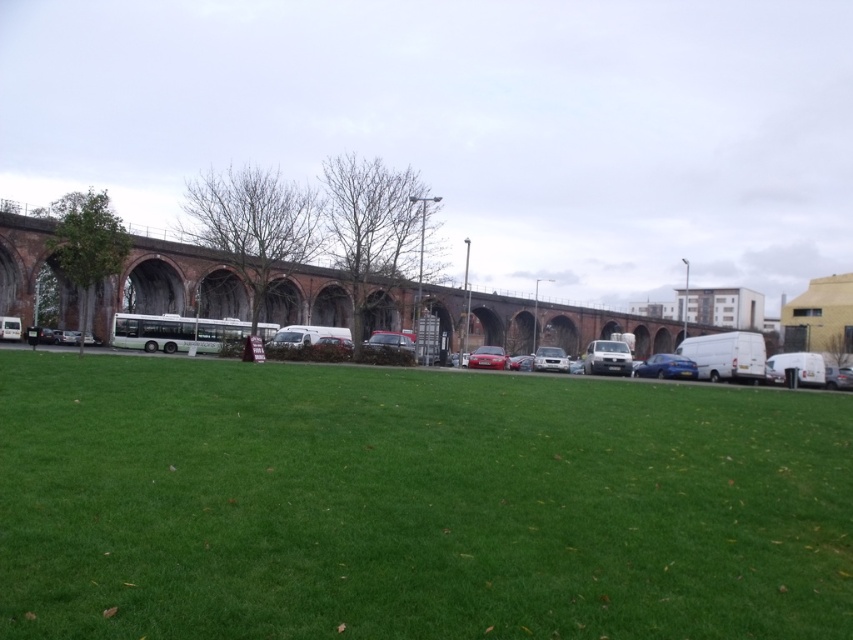
You are a delivery driver who needs to park your vehicle in the parking lot. You have a white matte van at center and a glossy red car at center. Which vehicle will require more space to park?

The white matte van at center is larger in size than the glossy red car at center, so it will require more space to park.